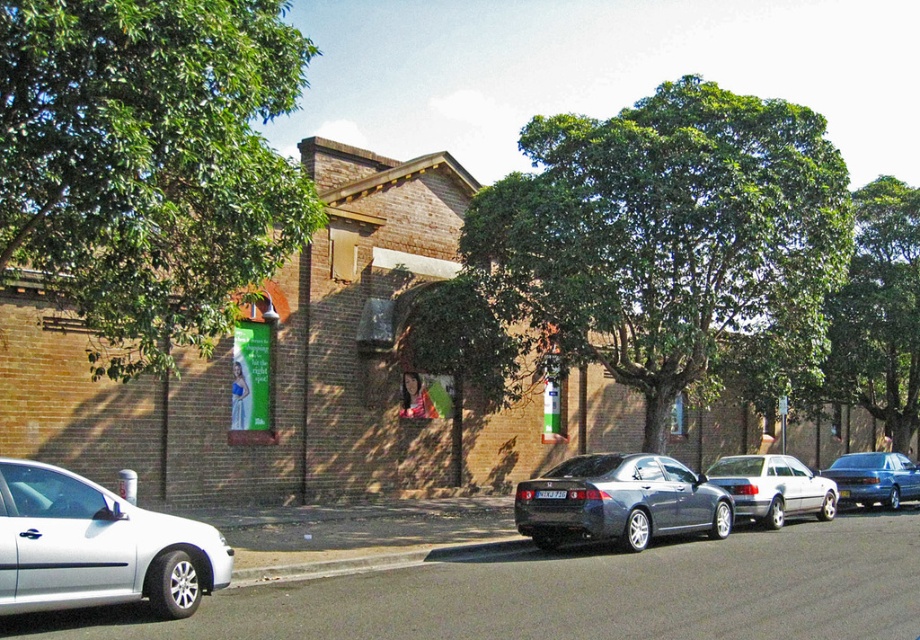
Question: Which of the following is the farthest from the observer?

Choices:
 (A) (869, 484)
 (B) (759, 259)

Answer: (A)

Question: Does green leafy tree at center come behind silver metallic car at left?

Choices:
 (A) no
 (B) yes

Answer: (B)

Question: Which point is closer to the camera?

Choices:
 (A) green leafy tree at center
 (B) metallic blue sedan at center
 (C) green leafy tree at upper right

Answer: (A)

Question: Observing the image, what is the correct spatial positioning of green leafy tree at upper right in reference to metallic blue sedan at center?

Choices:
 (A) left
 (B) right

Answer: (A)

Question: Which object appears closest to the camera in this image?

Choices:
 (A) silver metallic car at left
 (B) metallic blue sedan at center
 (C) green leafy tree at upper left
 (D) silver metallic sedan at center-right

Answer: (A)

Question: Does silver metallic car at left appear on the right side of satin dark gray sedan at center?

Choices:
 (A) no
 (B) yes

Answer: (A)